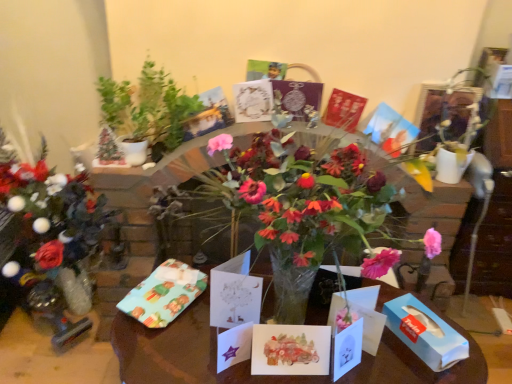
Question: From a real-world perspective, is white paper card at center, the third birthday card when ordered from back to front, physically located above or below matte paper cards at center?

Choices:
 (A) below
 (B) above

Answer: (B)

Question: Is white paper card at center, the third birthday card when ordered from back to front, spatially inside matte paper cards at center, or outside of it?

Choices:
 (A) inside
 (B) outside

Answer: (B)

Question: Estimate the real-world distances between objects in this image. Which object is closer to the matte red card at center, the second birthday card when ordered from top to bottom?

Choices:
 (A) white paper card at center, which is the 1th birthday card in front-to-back order
 (B) matte paper cards at center
 (C) watercolor paper card at center, marked as the 4th birthday card in a back-to-front arrangement
 (D) blue paper tissue box at lower right
 (E) matte paper card at center, which ranks as the 3th birthday card in top-to-bottom order

Answer: (E)

Question: Which object is positioned farthest from the watercolor paper card at center, arranged as the 2th birthday card when ordered from the bottom?

Choices:
 (A) blue paper tissue box at lower right
 (B) white paper card at center, which appears as the 3th birthday card when viewed from the front
 (C) green leafy plant at upper left
 (D) matte paper cards at center
 (E) matte paper card at center, the 2th birthday card from the back

Answer: (C)